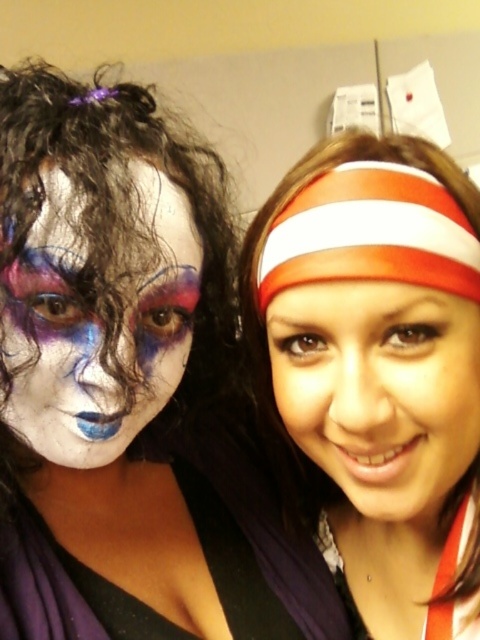
Between matte white headband at upper right and smooth skin face at center, which one has more height?

With more height is matte white headband at upper right.

What are the coordinates of `matte white headband at upper right` in the screenshot? It's located at (128, 387).

Can you confirm if white/red striped headband at upper right is positioned to the left of smooth skin face at center?

In fact, white/red striped headband at upper right is to the right of smooth skin face at center.

Between white/red striped headband at upper right and smooth skin face at center, which one appears on the left side from the viewer's perspective?

Positioned to the left is smooth skin face at center.

The image size is (480, 640). Describe the element at coordinates (375, 369) in the screenshot. I see `white/red striped headband at upper right` at that location.

This screenshot has width=480, height=640. In order to click on white/red striped headband at upper right in this screenshot , I will do `click(375, 369)`.

The image size is (480, 640). What do you see at coordinates (375, 369) in the screenshot?
I see `white/red striped headband at upper right` at bounding box center [375, 369].

Can you confirm if white/red striped headband at upper right is shorter than matte white face paint at left?

Incorrect, white/red striped headband at upper right's height does not fall short of matte white face paint at left's.

Between point (241, 310) and point (147, 289), which one is positioned in front?

Point (147, 289) is in front.

The height and width of the screenshot is (640, 480). I want to click on white/red striped headband at upper right, so click(x=375, y=369).